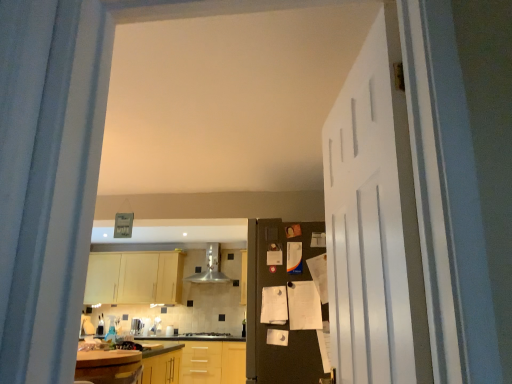
Question: Does satin silver toaster at center have a lesser width compared to wooden laminate countertop at lower left, arranged as the second countertop when ordered from the bottom?

Choices:
 (A) yes
 (B) no

Answer: (A)

Question: Is satin silver toaster at center in front of wooden laminate countertop at lower left, the 1th countertop in the top-to-bottom sequence?

Choices:
 (A) no
 (B) yes

Answer: (A)

Question: Does satin silver toaster at center come behind wooden laminate countertop at lower left, the 1th countertop in the top-to-bottom sequence?

Choices:
 (A) no
 (B) yes

Answer: (B)

Question: From the image's perspective, does satin silver toaster at center appear lower than wooden laminate countertop at lower left, the first countertop viewed from the front?

Choices:
 (A) no
 (B) yes

Answer: (B)

Question: Can we say satin silver toaster at center lies outside wooden laminate countertop at lower left, arranged as the second countertop when ordered from the bottom?

Choices:
 (A) no
 (B) yes

Answer: (B)

Question: Considering the positions of stainless steel exhaust hood at center and wooden at center, marked as the first countertop in a bottom-to-top arrangement, in the image, is stainless steel exhaust hood at center taller or shorter than wooden at center, marked as the first countertop in a bottom-to-top arrangement,?

Choices:
 (A) short
 (B) tall

Answer: (A)

Question: Looking at the image, does stainless steel exhaust hood at center seem bigger or smaller compared to wooden at center, positioned as the 2th countertop in front-to-back order?

Choices:
 (A) big
 (B) small

Answer: (B)

Question: Is stainless steel exhaust hood at center to the left or to the right of wooden at center, which is counted as the 1th countertop, starting from the back, in the image?

Choices:
 (A) left
 (B) right

Answer: (B)

Question: Does point (210, 261) appear closer or farther from the camera than point (156, 382)?

Choices:
 (A) farther
 (B) closer

Answer: (A)

Question: In terms of size, does stainless steel exhaust hood at center appear bigger or smaller than white matte door at right, arranged as the 2th door when viewed from the back?

Choices:
 (A) small
 (B) big

Answer: (B)

Question: Is stainless steel exhaust hood at center inside the boundaries of white matte door at right, arranged as the 2th door when viewed from the back, or outside?

Choices:
 (A) inside
 (B) outside

Answer: (B)

Question: Looking at their shapes, would you say stainless steel exhaust hood at center is wider or thinner than white matte door at right, arranged as the 2th door when viewed from the back?

Choices:
 (A) wide
 (B) thin

Answer: (A)

Question: Is stainless steel exhaust hood at center in front of or behind white matte door at right, arranged as the 2th door when viewed from the back, in the image?

Choices:
 (A) front
 (B) behind

Answer: (B)

Question: Looking at the image, does satin silver toaster at center seem bigger or smaller compared to wooden at center, which appears as the 2th countertop when viewed from the top?

Choices:
 (A) small
 (B) big

Answer: (A)

Question: From a real-world perspective, relative to wooden at center, which appears as the 2th countertop when viewed from the top, is satin silver toaster at center vertically above or below?

Choices:
 (A) below
 (B) above

Answer: (B)